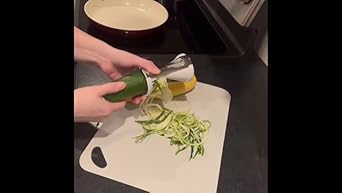
What are the coordinates of `grey wall` in the screenshot? It's located at (262, 39).